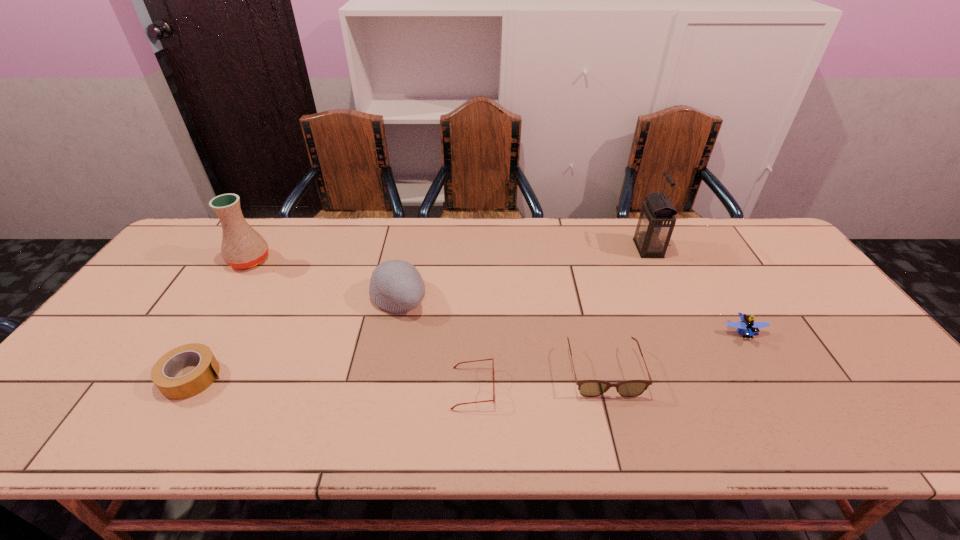
What are the coordinates of `the shorter spectacles` in the screenshot? It's located at (493, 400).

You are a GUI agent. You are given a task and a screenshot of the screen. Output one action in this format:
    pyautogui.click(x=<x>, y=<y>)
    Task: Click on the free spot located 0.190m on the front-facing side of the tallest object
    The width and height of the screenshot is (960, 540).
    Given the screenshot: What is the action you would take?
    pyautogui.click(x=576, y=248)

Identify the location of vacant space located on the front-facing side of the tallest object. The image size is (960, 540). (585, 248).

Find the location of a particular element. This screenshot has height=540, width=960. free spot located 0.220m on the front-facing side of the tallest object is located at coordinates (566, 248).

Where is `blank space located 0.130m on the left of the second tallest object`? The image size is (960, 540). blank space located 0.130m on the left of the second tallest object is located at coordinates (186, 260).

This screenshot has width=960, height=540. What are the coordinates of `free space located on the left of the beanie` in the screenshot? It's located at (275, 297).

The height and width of the screenshot is (540, 960). I want to click on free space located on the front-facing side of the Lego, so click(x=794, y=416).

I want to click on vacant space situated 0.100m at the front view of the right spectacles, so click(x=620, y=438).

Find the location of a particular element. The image size is (960, 540). vacant space located at the edge of the duct tape is located at coordinates (330, 377).

Identify the location of vacant point located 0.340m on the face of the shorter spectacles. coord(640,388).